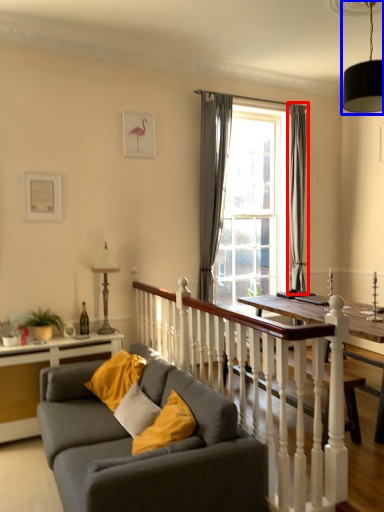
Question: Among these objects, which one is farthest to the camera, curtain (highlighted by a red box) or light fixture (highlighted by a blue box)?

Choices:
 (A) curtain
 (B) light fixture

Answer: (A)